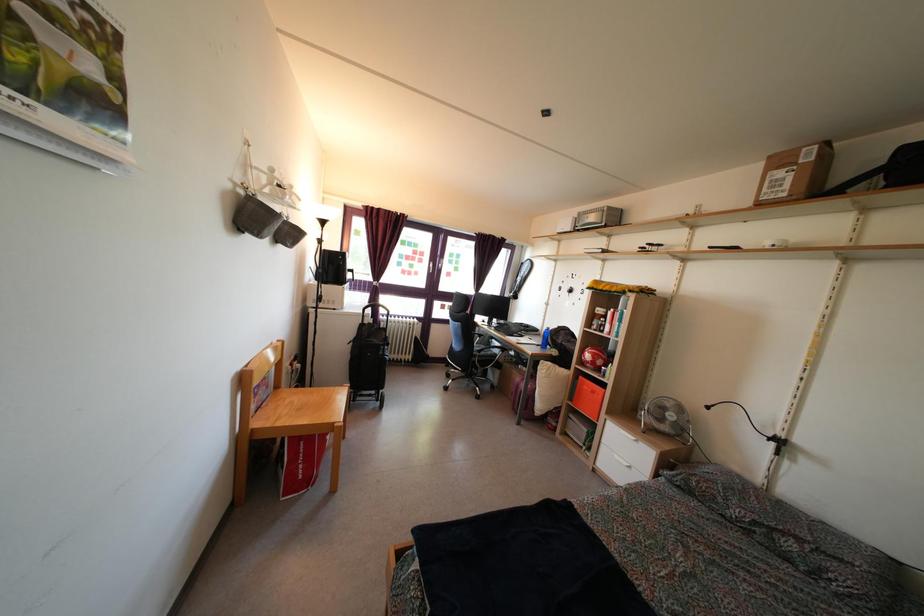
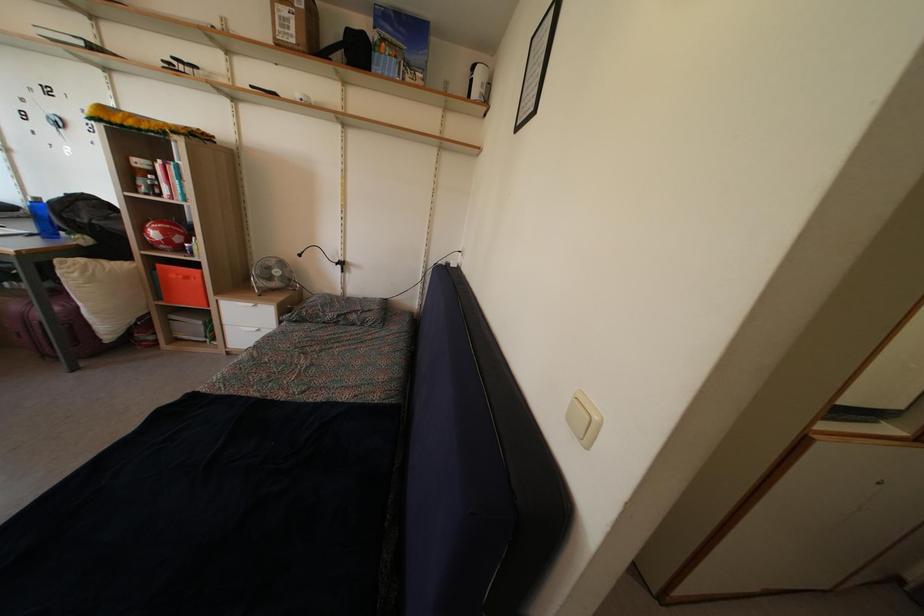
The point at (590, 365) is marked in the first image. Where is the corresponding point in the second image?

(157, 243)